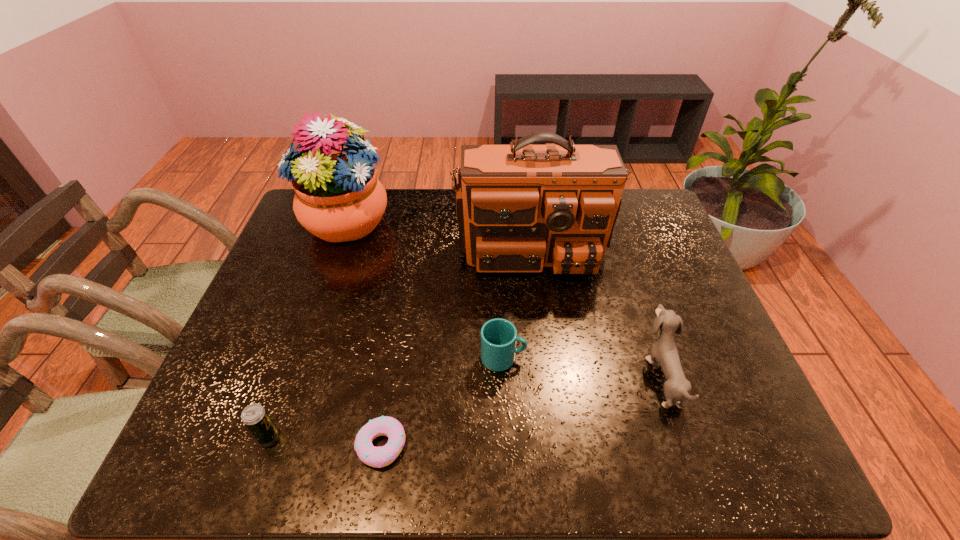
This screenshot has height=540, width=960. What are the coordinates of `satchel` in the screenshot? It's located at [520, 207].

The width and height of the screenshot is (960, 540). What are the coordinates of `flower arrangement` in the screenshot? It's located at (338, 198).

Locate an element on the screen. The width and height of the screenshot is (960, 540). the fourth shortest object is located at coordinates (664, 350).

Locate an element on the screen. cup is located at coordinates (499, 336).

Locate an element on the screen. The image size is (960, 540). beer can is located at coordinates click(256, 419).

This screenshot has height=540, width=960. I want to click on doughnut, so click(x=378, y=457).

This screenshot has height=540, width=960. In order to click on the fourth object from right to left in this screenshot , I will do `click(378, 457)`.

This screenshot has height=540, width=960. I want to click on vacant space located on the face side of the satchel, so click(541, 330).

The height and width of the screenshot is (540, 960). What are the coordinates of `vacant space located 0.370m on the front of the flower arrangement` in the screenshot? It's located at (300, 360).

Where is `free spot located at the face of the puppy`? This screenshot has height=540, width=960. free spot located at the face of the puppy is located at coordinates (487, 376).